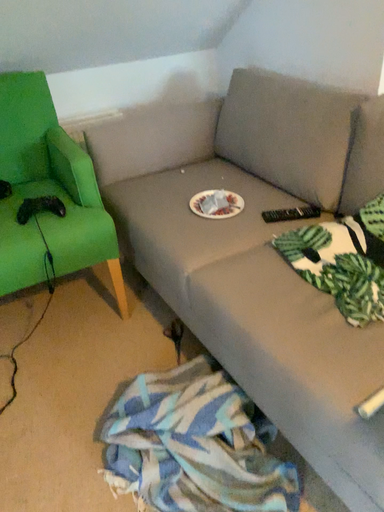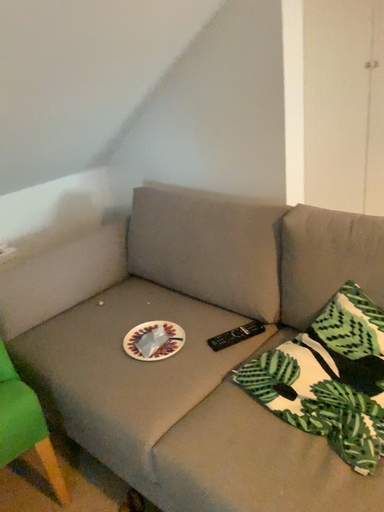
Question: Which way did the camera rotate in the video?

Choices:
 (A) rotated left
 (B) rotated right

Answer: (B)